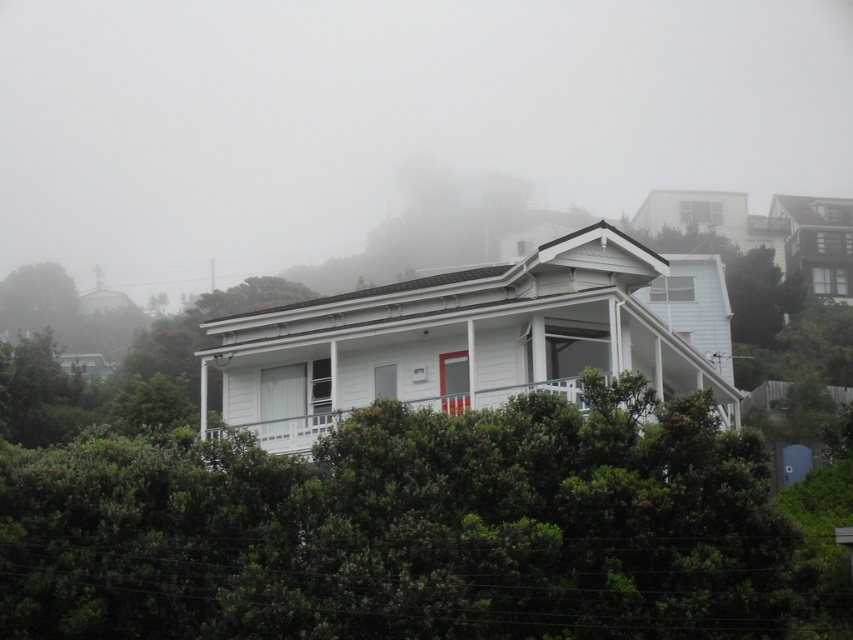
Question: Among these objects, which one is farthest from the camera?

Choices:
 (A) white painted wood porch at center
 (B) foggy white house at center

Answer: (B)

Question: Which of the following is the farthest from the observer?

Choices:
 (A) foggy white house at center
 (B) white painted wood porch at center

Answer: (A)

Question: Among these points, which one is farthest from the camera?

Choices:
 (A) (599, 380)
 (B) (160, 198)

Answer: (B)

Question: Is foggy white house at center to the left of white painted wood porch at center from the viewer's perspective?

Choices:
 (A) no
 (B) yes

Answer: (B)

Question: Is foggy white house at center smaller than white painted wood porch at center?

Choices:
 (A) yes
 (B) no

Answer: (B)

Question: Is foggy white house at center in front of white painted wood porch at center?

Choices:
 (A) no
 (B) yes

Answer: (A)